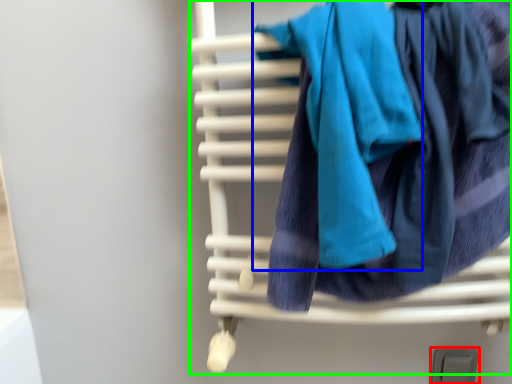
Question: Which object is the farthest from window (highlighted by a red box)? Choose among these: bath towel (highlighted by a blue box) or furniture (highlighted by a green box).

Choices:
 (A) bath towel
 (B) furniture

Answer: (A)